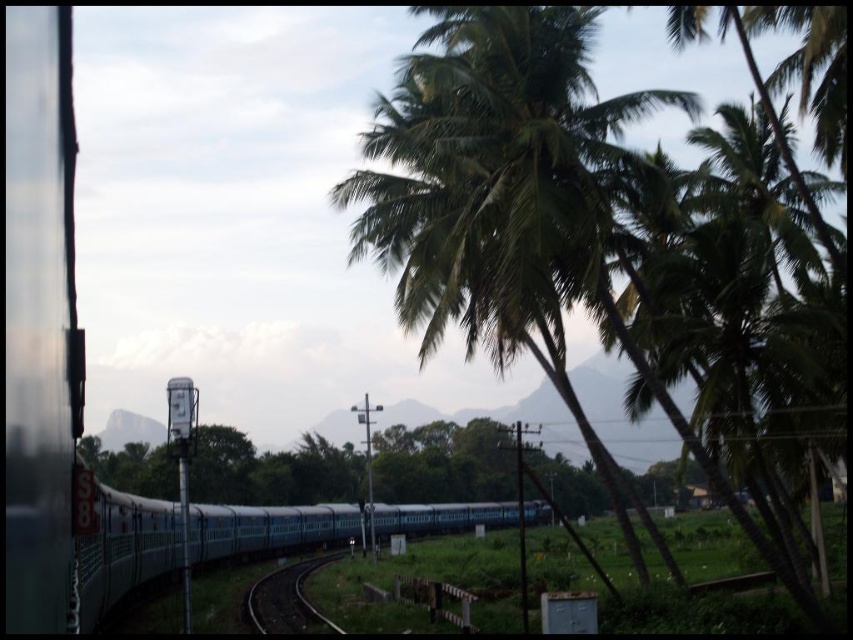
Question: Is green leafy coconut tree at center smaller than black metal track at center?

Choices:
 (A) no
 (B) yes

Answer: (B)

Question: Among these points, which one is farthest from the camera?

Choices:
 (A) (447, 160)
 (B) (258, 621)

Answer: (B)

Question: From the image, what is the correct spatial relationship of green leafy coconut tree at center in relation to black metal track at center?

Choices:
 (A) right
 (B) left

Answer: (A)

Question: Does green leafy coconut tree at center have a lesser width compared to black metal track at center?

Choices:
 (A) yes
 (B) no

Answer: (B)